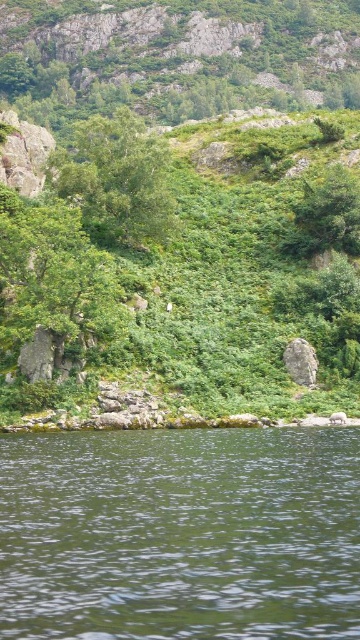
You are standing at the edge of the scene and want to cross to the other side. The green liquid water at bottom and the green leafy tree at left are in your path. Which one do you need to go around first?

You need to go around the green leafy tree at left first because the green liquid water at bottom is wider than the green leafy tree at left, so it might require a longer detour.

You are standing at the point with coordinates point (159, 202) and want to move towards the point with coordinates point (137, 497). Given the landscape described, will you have an unobstructed path to reach the destination?

Point (137, 497) is in front of point (159, 202), so yes, you will have an unobstructed path to reach the destination as it is positioned in front of your current location.